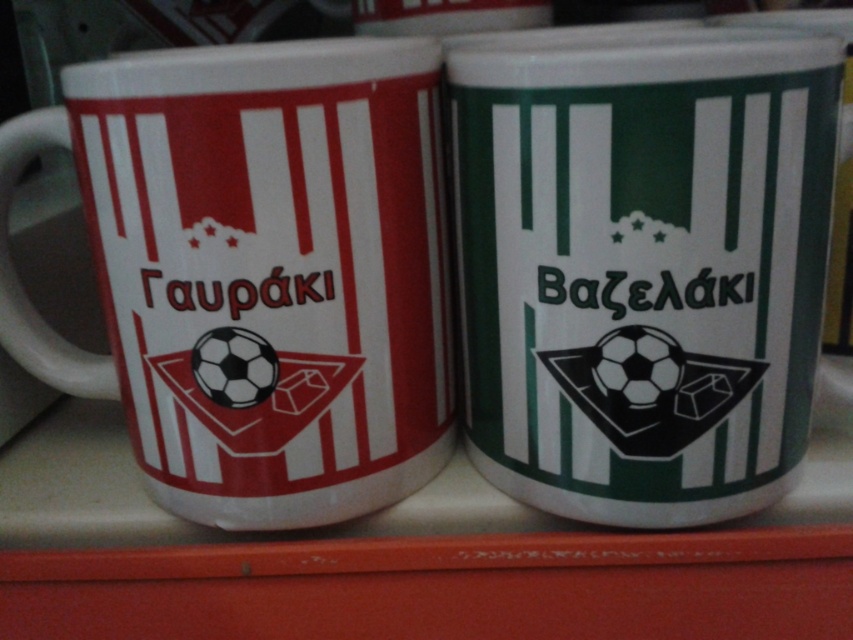
Is green matte mug at center positioned in front of matte white mug at left?

Yes, green matte mug at center is closer to the viewer.

Does green matte mug at center have a greater height compared to matte white mug at left?

Yes.

Does point (544, 250) come in front of point (171, 177)?

No, it is behind (171, 177).

In order to click on green matte mug at center in this screenshot , I will do `click(643, 266)`.